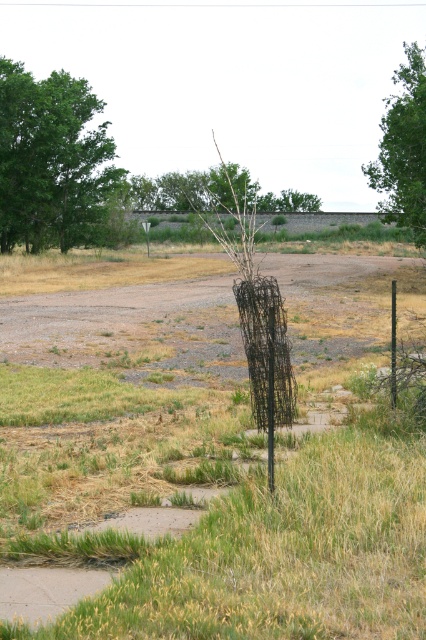
Is green leafy tree at upper left bigger than green leafy tree at upper right?

Incorrect, green leafy tree at upper left is not larger than green leafy tree at upper right.

Does green leafy tree at upper left lie in front of green leafy tree at upper right?

No, it is behind green leafy tree at upper right.

Who is more distant from viewer, (x=86, y=161) or (x=408, y=209)?

Point (x=86, y=161)

Identify the location of green leafy tree at upper left. The image size is (426, 640). (51, 161).